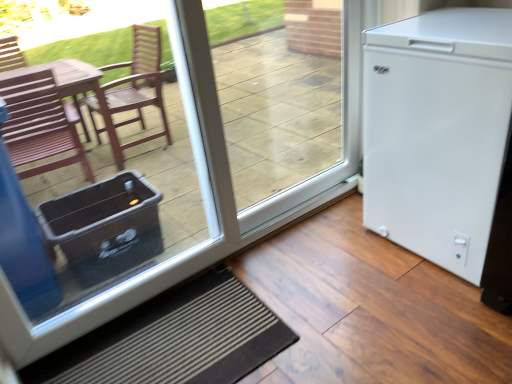
The image size is (512, 384). What are the coordinates of `free space to the right of black textured mat at lower center` in the screenshot? It's located at (350, 308).